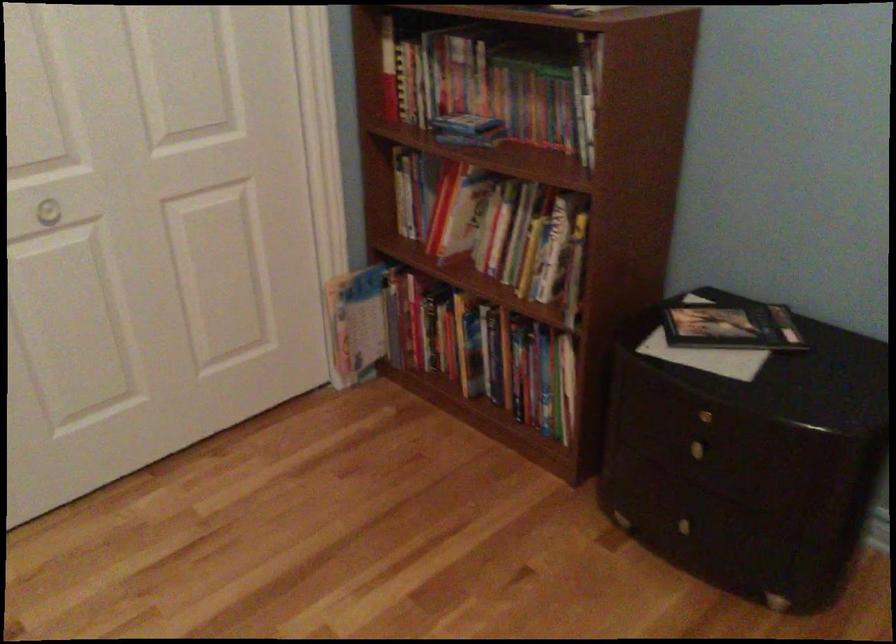
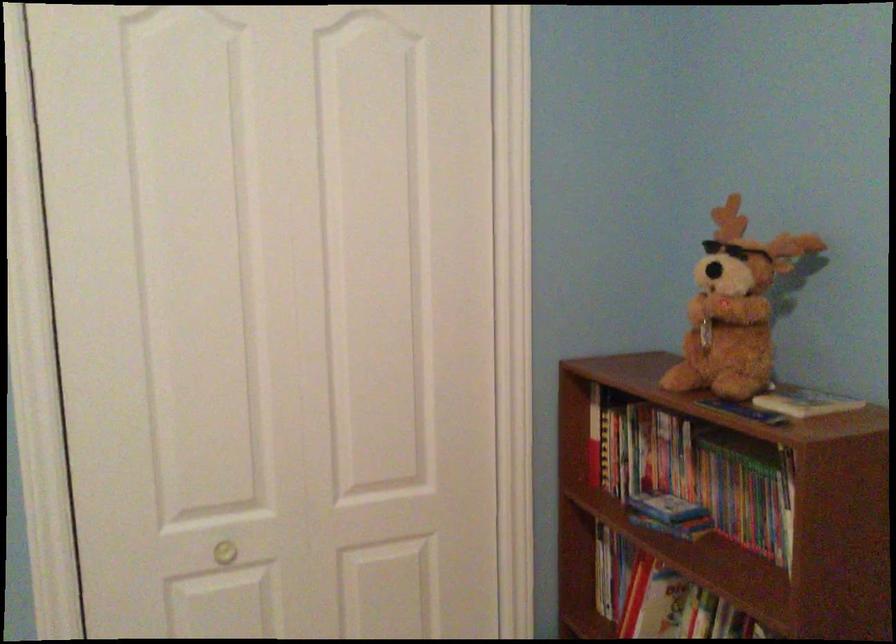
From the picture: The images are taken continuously from a first-person perspective. In which direction are you moving?

The movement direction of the cameraman is right, forward.